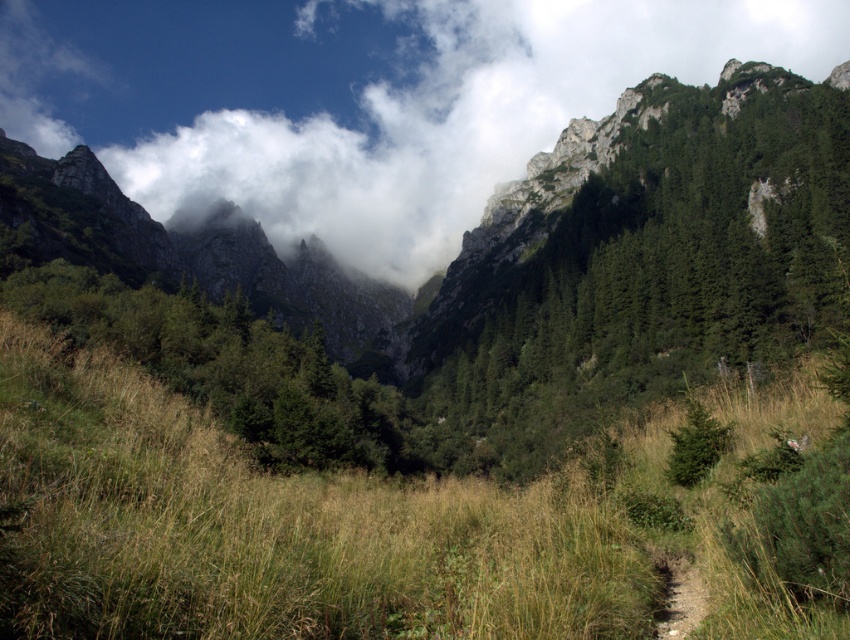
Question: Is green grassy at center wider than brown dirt trail at lower right?

Choices:
 (A) no
 (B) yes

Answer: (B)

Question: Which of the following is the farthest from the observer?

Choices:
 (A) (417, 160)
 (B) (675, 611)
 (C) (466, 636)

Answer: (A)

Question: Is green grassy at center smaller than white fluffy cloud at upper center?

Choices:
 (A) no
 (B) yes

Answer: (B)

Question: Where is white fluffy cloud at upper center located in relation to brown dirt trail at lower right in the image?

Choices:
 (A) right
 (B) left

Answer: (B)

Question: Estimate the real-world distances between objects in this image. Which object is farther from the green grassy at center?

Choices:
 (A) brown dirt trail at lower right
 (B) white fluffy cloud at upper center

Answer: (B)

Question: Considering the real-world distances, which object is farthest from the brown dirt trail at lower right?

Choices:
 (A) green grassy at center
 (B) white fluffy cloud at upper center

Answer: (B)